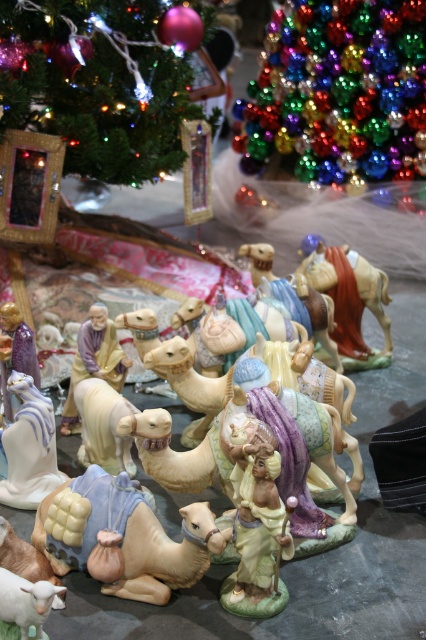
Is point (127, 572) farther from viewer compared to point (32, 477)?

No.

Is matte beige camel at center thinner than white glossy figurine at center?

In fact, matte beige camel at center might be wider than white glossy figurine at center.

Locate an element on the screen. Image resolution: width=426 pixels, height=640 pixels. matte beige camel at center is located at coordinates (123, 538).

This screenshot has height=640, width=426. Identify the location of matte beige camel at center. (123, 538).

Does porcelain camel at center come behind matte beige camel at center?

Yes, porcelain camel at center is behind matte beige camel at center.

Who is more forward, (141, 280) or (135, 532)?

Point (135, 532)

What are the coordinates of `porcelain camel at center` in the screenshot? It's located at (x=115, y=280).

Is shiny metallic ornament at upper center to the right of porcelain camel at center from the viewer's perspective?

No, shiny metallic ornament at upper center is not to the right of porcelain camel at center.

Does shiny metallic ornament at upper center come behind porcelain camel at center?

Yes.

Does point (36, 61) come behind point (100, 358)?

Yes, it is behind point (100, 358).

Where is `shiny metallic ornament at upper center`? The image size is (426, 640). shiny metallic ornament at upper center is located at coordinates (95, 84).